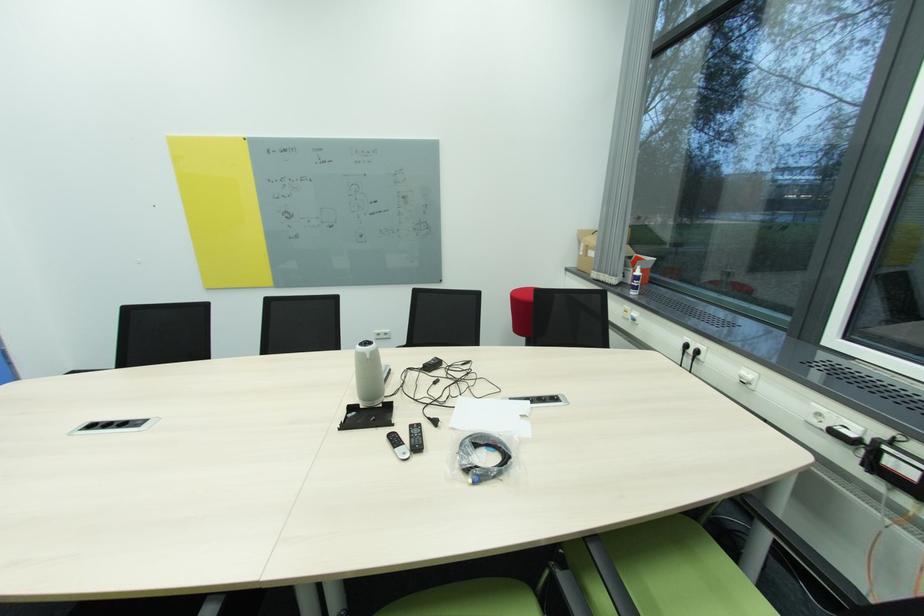
The location [635,280] corresponds to which object?

It corresponds to the white plastic bottle in the image.